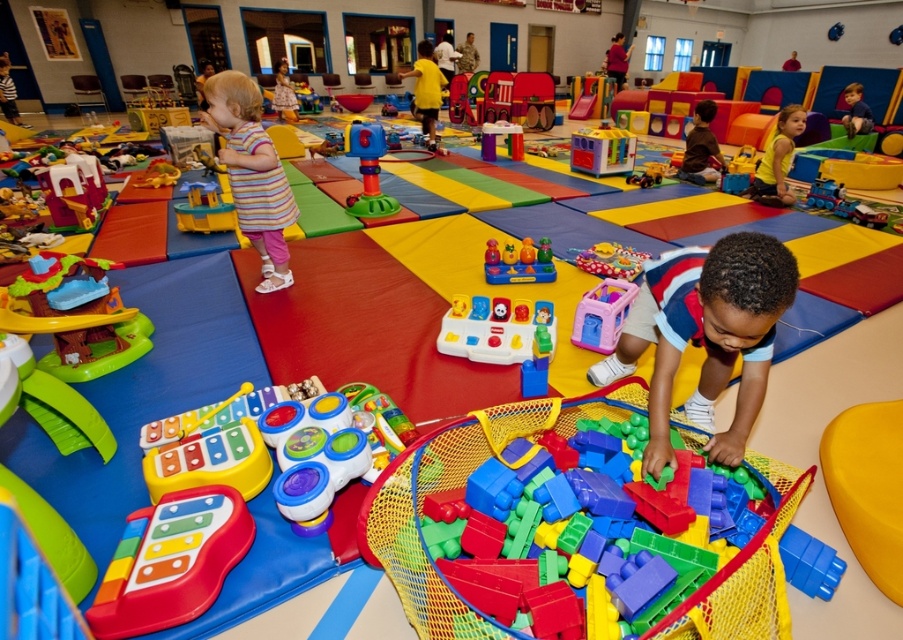
Is point (610, 292) farther from camera compared to point (483, 257)?

No, (610, 292) is closer to viewer.

Does pink plastic playhouse at center lie behind multicolored plastic toy at center?

No, it is not.

Is point (593, 323) closer to camera compared to point (538, 260)?

Yes.

You are a GUI agent. You are given a task and a screenshot of the screen. Output one action in this format:
    pyautogui.click(x=<x>, y=<y>)
    Task: Click on the pink plastic playhouse at center
    
    Given the screenshot: What is the action you would take?
    pyautogui.click(x=602, y=314)

Is metallic blue train at lower right positioned in front of rubberized plastic toy car at center?

Yes.

Looking at this image, measure the distance between metallic blue train at lower right and camera.

metallic blue train at lower right and camera are 4.37 meters apart from each other.

This screenshot has width=903, height=640. In order to click on metallic blue train at lower right in this screenshot , I will do `click(843, 204)`.

Who is lower down, multicolored plastic blocks at lower right or metallic blue train at lower right?

multicolored plastic blocks at lower right is below.

Does point (405, 524) come farther from viewer compared to point (857, 211)?

No, (405, 524) is closer to viewer.

Identify the location of multicolored plastic blocks at lower right. (729, 572).